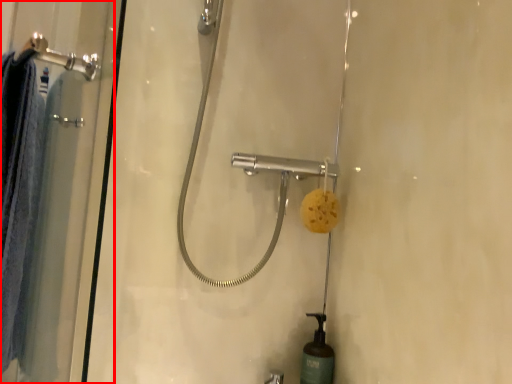
Question: Where is shower door (annotated by the red box) located in relation to shower in the image?

Choices:
 (A) right
 (B) left

Answer: (B)